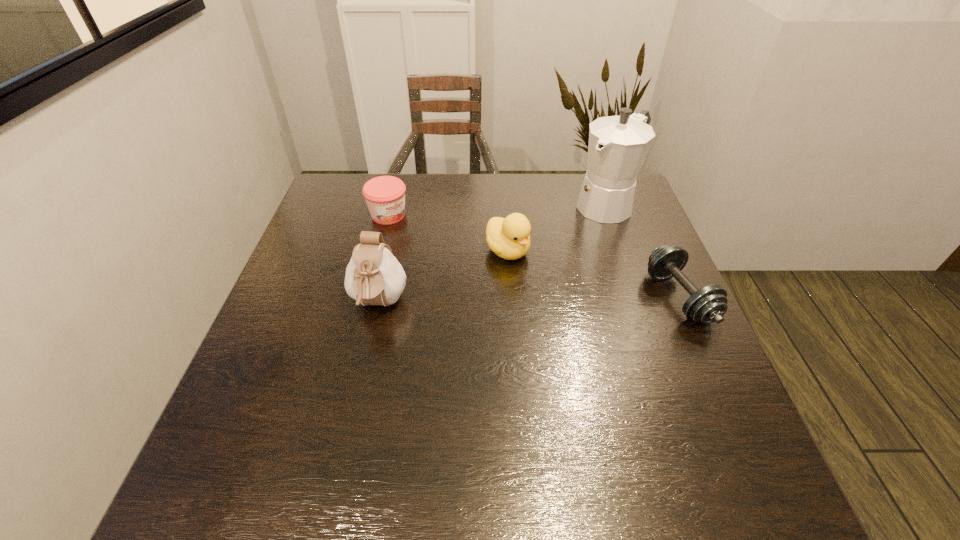
Find the location of `dumbbell that is at the right edge`. dumbbell that is at the right edge is located at coordinates pos(706,305).

Locate an element on the screen. The image size is (960, 540). coffeepot located at the right edge is located at coordinates (618, 145).

Image resolution: width=960 pixels, height=540 pixels. I want to click on object present at the far left corner, so click(x=385, y=195).

Identify the location of object that is at the far right corner. Image resolution: width=960 pixels, height=540 pixels. (618, 145).

Locate an element on the screen. The image size is (960, 540). vacant space at the far edge is located at coordinates (407, 177).

You are a GUI agent. You are given a task and a screenshot of the screen. Output one action in this format:
    pyautogui.click(x=<x>, y=<y>)
    Task: Click on the free location at the near edge
    
    Given the screenshot: What is the action you would take?
    click(326, 418)

Image resolution: width=960 pixels, height=540 pixels. In the image, there is a desktop. Find the location of `blank space at the left edge`. blank space at the left edge is located at coordinates (281, 329).

Locate an element on the screen. The image size is (960, 540). vacant space at the right edge is located at coordinates (629, 280).

Where is `free space at the far left corner of the desktop`? This screenshot has height=540, width=960. free space at the far left corner of the desktop is located at coordinates (338, 183).

This screenshot has width=960, height=540. I want to click on free space at the near left corner of the desktop, so click(240, 431).